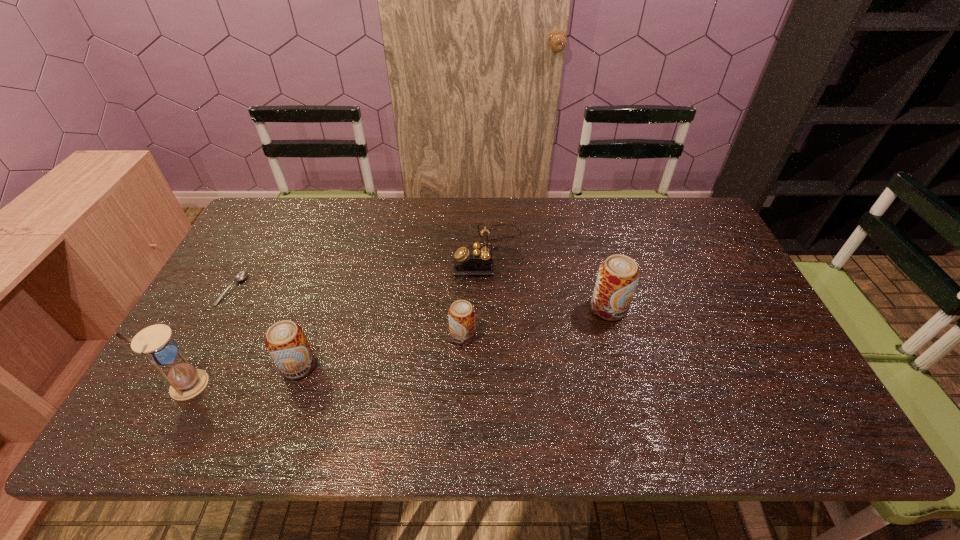
Find the location of `soupspoon that is at the left edge`. soupspoon that is at the left edge is located at coordinates (241, 276).

At what (x,y) coordinates should I click in order to perform the action: click on hourglass located in the left edge section of the desktop. Please return your answer as a coordinate pair (x, y). This screenshot has height=540, width=960. Looking at the image, I should click on (155, 342).

This screenshot has height=540, width=960. I want to click on object at the near left corner, so click(x=155, y=342).

Image resolution: width=960 pixels, height=540 pixels. I want to click on vacant space at the far edge of the desktop, so click(346, 224).

In the image, there is a desktop. Identify the location of vacant space at the near edge. (615, 370).

The height and width of the screenshot is (540, 960). Identify the location of vacant space at the right edge of the desktop. (733, 312).

Find the location of a particular element. Image resolution: width=960 pixels, height=540 pixels. vacant region at the far left corner is located at coordinates (257, 214).

The image size is (960, 540). Identify the location of blank space at the far right corner of the desktop. (699, 241).

This screenshot has width=960, height=540. What are the coordinates of `free space at the near right corner` in the screenshot? It's located at (772, 386).

Locate an element on the screen. free spot between the telephone and the shortest object is located at coordinates (361, 271).